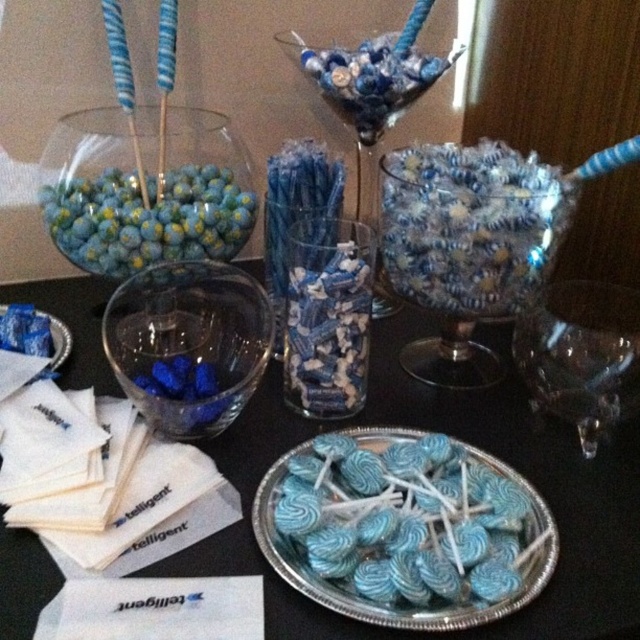
Question: Can you confirm if transparent glass at center is positioned to the right of matte blue lollipops at center?

Choices:
 (A) yes
 (B) no

Answer: (A)

Question: Which point is farther from the camera taking this photo?

Choices:
 (A) (636, 292)
 (B) (413, 477)
 (C) (400, 44)
 (D) (154, 360)

Answer: (C)

Question: Observing the image, what is the correct spatial positioning of matte blue lollipops at center in reference to translucent glass vase at center?

Choices:
 (A) right
 (B) left

Answer: (B)

Question: Does transparent glass at center appear on the left side of transparent glass wine glass at center?

Choices:
 (A) yes
 (B) no

Answer: (A)

Question: Estimate the real-world distances between objects in this image. Which object is closer to the transparent glass at center?

Choices:
 (A) translucent glass bowl at center
 (B) blue glossy lollipops at center
 (C) transparent glass wine glass at center

Answer: (B)

Question: Which is farther from the translucent glass bowl at center?

Choices:
 (A) matte blue lollipops at center
 (B) blue glossy lollipops at center
 (C) translucent glass vase at center
 (D) transparent glass at center

Answer: (A)